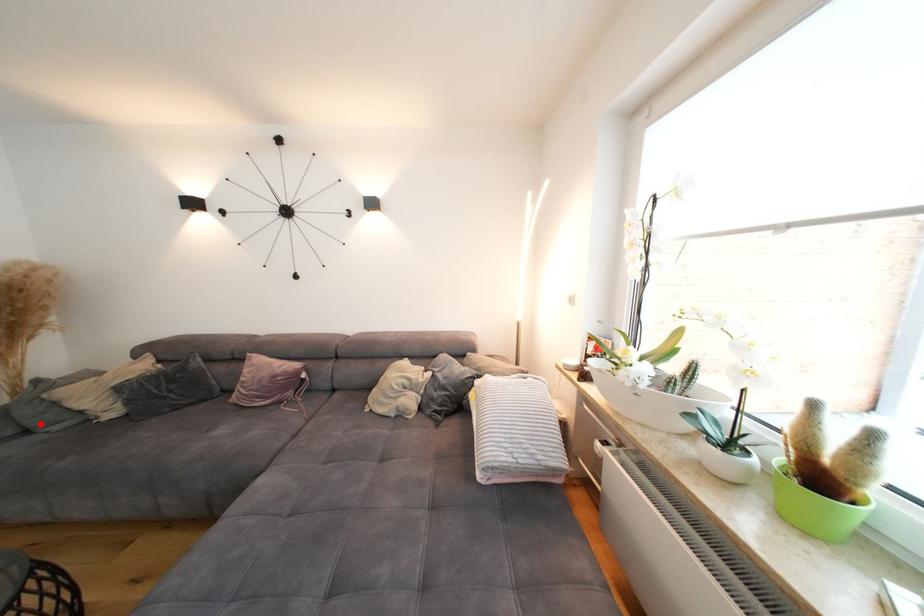
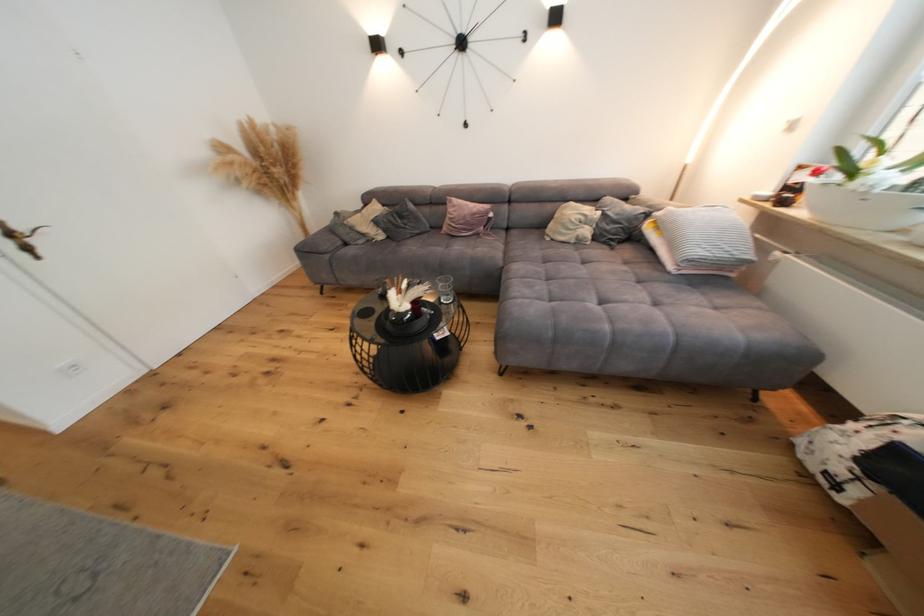
Where in the second image is the point corresponding to the highlighted location from the first image?

(354, 240)